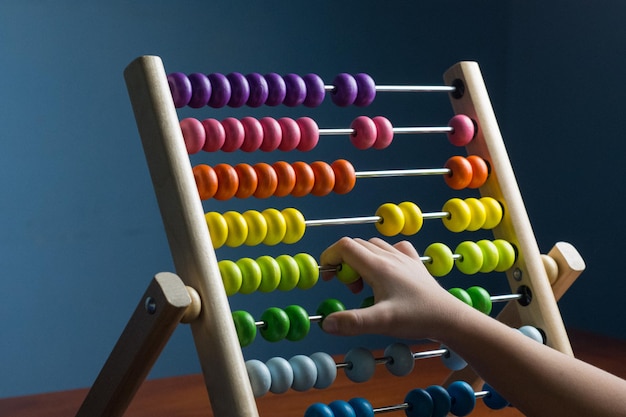
Identify the location of pink bead. (198, 140), (211, 140), (235, 137), (250, 137), (274, 137), (294, 139), (310, 133), (366, 135), (387, 131), (467, 133).